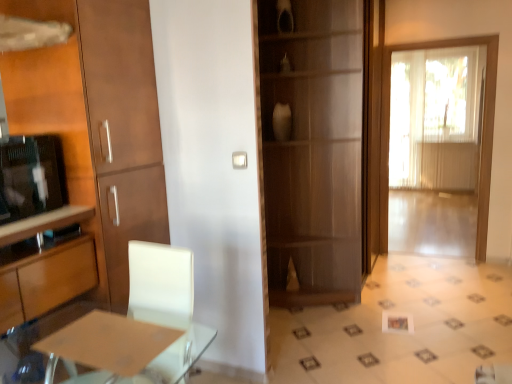
Question: From the image's perspective, is matte brown table at lower left below wooden cabinet at left, arranged as the first cabinetry when ordered from the bottom?

Choices:
 (A) no
 (B) yes

Answer: (A)

Question: Is matte brown table at lower left closer to camera compared to wooden cabinet at left, positioned as the second cabinetry in top-to-bottom order?

Choices:
 (A) yes
 (B) no

Answer: (A)

Question: Is wooden cabinet at left, arranged as the first cabinetry when ordered from the bottom, completely or partially inside matte brown table at lower left?

Choices:
 (A) yes
 (B) no

Answer: (B)

Question: Does matte brown table at lower left have a larger size compared to wooden cabinet at left, positioned as the second cabinetry in top-to-bottom order?

Choices:
 (A) yes
 (B) no

Answer: (B)

Question: Does matte brown table at lower left touch wooden cabinet at left, arranged as the first cabinetry when ordered from the bottom?

Choices:
 (A) no
 (B) yes

Answer: (A)

Question: From a real-world perspective, is matte wood cabinet at left, marked as the second cabinetry in a bottom-to-top arrangement, physically located above or below matte brown table at lower left?

Choices:
 (A) above
 (B) below

Answer: (A)

Question: Is matte wood cabinet at left, marked as the second cabinetry in a bottom-to-top arrangement, wider or thinner than matte brown table at lower left?

Choices:
 (A) wide
 (B) thin

Answer: (A)

Question: Is matte wood cabinet at left, the first cabinetry from the top, inside the boundaries of matte brown table at lower left, or outside?

Choices:
 (A) inside
 (B) outside

Answer: (B)

Question: Is point (125, 3) closer or farther from the camera than point (165, 365)?

Choices:
 (A) closer
 (B) farther

Answer: (B)

Question: Considering their positions, is white sheer curtain at right located in front of or behind wooden cabinet at left, positioned as the second cabinetry in top-to-bottom order?

Choices:
 (A) behind
 (B) front

Answer: (A)

Question: From the image's perspective, is white sheer curtain at right above or below wooden cabinet at left, positioned as the second cabinetry in top-to-bottom order?

Choices:
 (A) below
 (B) above

Answer: (B)

Question: Is white sheer curtain at right situated inside wooden cabinet at left, positioned as the second cabinetry in top-to-bottom order, or outside?

Choices:
 (A) inside
 (B) outside

Answer: (B)

Question: Is point (415, 187) closer or farther from the camera than point (49, 269)?

Choices:
 (A) farther
 (B) closer

Answer: (A)

Question: Is matte wood cabinet at left, the first cabinetry from the top, inside or outside of matte black television at left?

Choices:
 (A) inside
 (B) outside

Answer: (B)

Question: Looking at the image, does matte wood cabinet at left, the first cabinetry from the top, seem bigger or smaller compared to matte black television at left?

Choices:
 (A) small
 (B) big

Answer: (B)